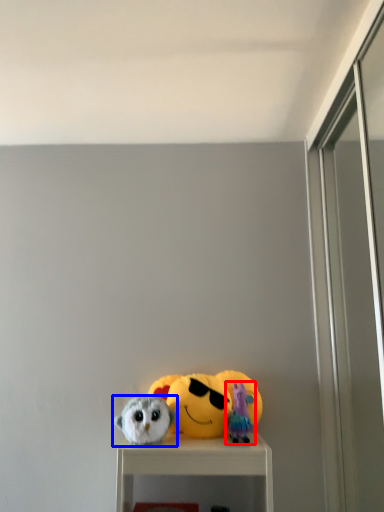
Question: Which point is further to the camera, toy (highlighted by a red box) or toy (highlighted by a blue box)?

Choices:
 (A) toy
 (B) toy

Answer: (A)